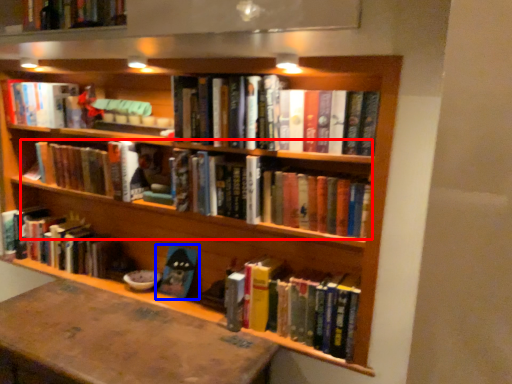
Question: Which point is further to the camera, book (highlighted by a red box) or book (highlighted by a blue box)?

Choices:
 (A) book
 (B) book

Answer: (B)